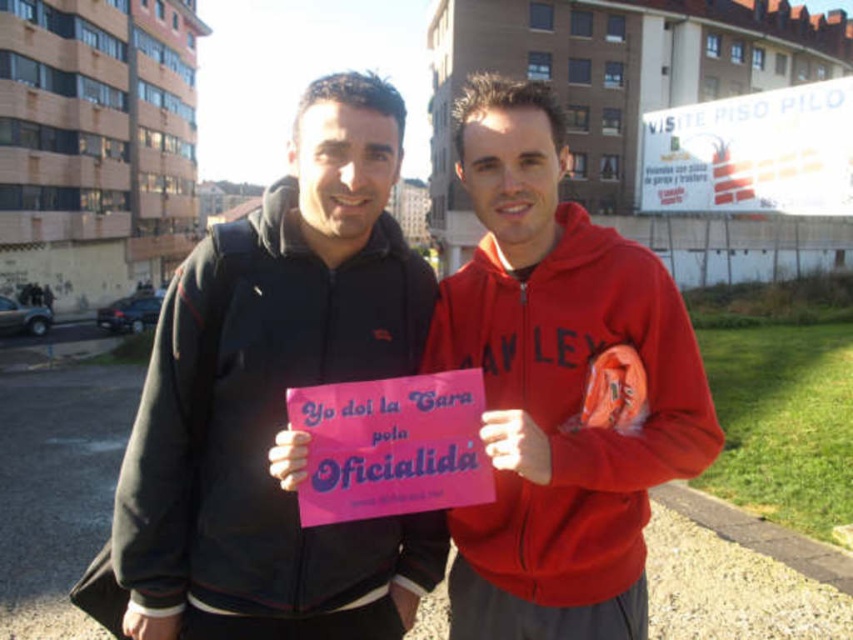
Question: Does matte red hoodie at center appear under white paper sign at upper right?

Choices:
 (A) yes
 (B) no

Answer: (A)

Question: In this image, where is pink matte sign at center located relative to matte red hoodie at center?

Choices:
 (A) right
 (B) left

Answer: (A)

Question: Is pink paper sign at center to the right of white paper sign at upper right from the viewer's perspective?

Choices:
 (A) no
 (B) yes

Answer: (A)

Question: Which point is farther to the camera?

Choices:
 (A) matte red hoodie at center
 (B) pink paper sign at center
 (C) pink matte sign at center

Answer: (A)

Question: Which of the following is the farthest from the observer?

Choices:
 (A) white paper sign at upper right
 (B) pink matte sign at center
 (C) matte red hoodie at center
 (D) pink paper sign at center

Answer: (A)

Question: Among these points, which one is farthest from the camera?

Choices:
 (A) (520, 465)
 (B) (564, 545)

Answer: (B)